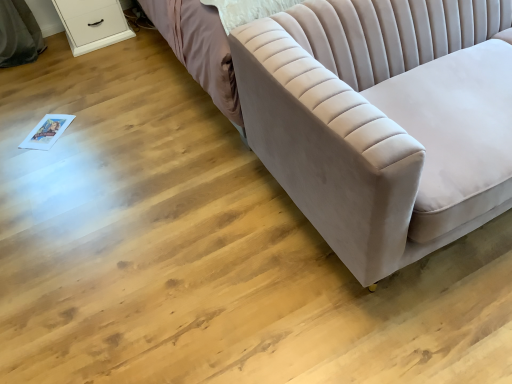
Image resolution: width=512 pixels, height=384 pixels. What do you see at coordinates (92, 23) in the screenshot? I see `white glossy dresser at upper left` at bounding box center [92, 23].

What are the coordinates of `white glossy dresser at upper left` in the screenshot? It's located at (92, 23).

Measure the distance between white glossy dresser at upper left and camera.

white glossy dresser at upper left is 9.16 feet away from camera.

Measure the distance between point [294,183] and camera.

Point [294,183] and camera are 1.51 meters apart.

What do you see at coordinates (383, 120) in the screenshot? This screenshot has height=384, width=512. I see `velvet beige couch at right` at bounding box center [383, 120].

In order to face velvet beige couch at right, should I rotate leftwards or rightwards?

It's best to rotate right around 28.003 degrees.

Measure the distance between velvet beige couch at right and camera.

The depth of velvet beige couch at right is 37.84 inches.

Where is `velvet beige couch at right`? The width and height of the screenshot is (512, 384). velvet beige couch at right is located at coordinates (383, 120).

Where is `white glossy dresser at upper left`? The height and width of the screenshot is (384, 512). white glossy dresser at upper left is located at coordinates (92, 23).

Would you say velvet beige couch at right is to the left or to the right of white glossy dresser at upper left in the picture?

velvet beige couch at right is to the right of white glossy dresser at upper left.

Which object is closer to the camera taking this photo, velvet beige couch at right or white glossy dresser at upper left?

velvet beige couch at right is in front.

Does point (352, 3) come closer to viewer compared to point (87, 5)?

Yes.

From the image's perspective, is velvet beige couch at right above or below white glossy dresser at upper left?

Clearly, from the image's perspective, velvet beige couch at right is below white glossy dresser at upper left.

From a real-world perspective, who is located lower, velvet beige couch at right or white glossy dresser at upper left?

In real-world perspective, white glossy dresser at upper left is lower.

Can you confirm if velvet beige couch at right is wider than white glossy dresser at upper left?

Yes.

Considering the relative sizes of velvet beige couch at right and white glossy dresser at upper left in the image provided, is velvet beige couch at right taller than white glossy dresser at upper left?

Indeed, velvet beige couch at right has a greater height compared to white glossy dresser at upper left.

Looking at this image, between velvet beige couch at right and white glossy dresser at upper left, which one has smaller size?

Smaller between the two is white glossy dresser at upper left.

From the picture: Is white glossy dresser at upper left surrounded by velvet beige couch at right?

No.

Would you say velvet beige couch at right is a long distance from white glossy dresser at upper left?

That's right, there is a large distance between velvet beige couch at right and white glossy dresser at upper left.

Is velvet beige couch at right facing towards white glossy dresser at upper left?

No, velvet beige couch at right is not turned towards white glossy dresser at upper left.

What's the angular difference between velvet beige couch at right and white glossy dresser at upper left's facing directions?

2.04 degrees separate the facing orientations of velvet beige couch at right and white glossy dresser at upper left.

In order to click on dresser above the velvet beige couch at right (from the image's perspective) in this screenshot , I will do `click(92, 23)`.

Consider the image. Which object is positioned more to the right, white glossy dresser at upper left or velvet beige couch at right?

From the viewer's perspective, velvet beige couch at right appears more on the right side.

Which object is more forward, white glossy dresser at upper left or velvet beige couch at right?

velvet beige couch at right is closer to the camera.

Is point (90, 33) less distant than point (319, 166)?

No, it is behind (319, 166).

From the image's perspective, would you say white glossy dresser at upper left is shown under velvet beige couch at right?

Actually, white glossy dresser at upper left appears above velvet beige couch at right in the image.

From a real-world perspective, is white glossy dresser at upper left positioned over velvet beige couch at right based on gravity?

No, from a real-world perspective, white glossy dresser at upper left is not on top of velvet beige couch at right.

Does white glossy dresser at upper left have a lesser width compared to velvet beige couch at right?

Yes, white glossy dresser at upper left is thinner than velvet beige couch at right.

In terms of height, does white glossy dresser at upper left look taller or shorter compared to velvet beige couch at right?

Clearly, white glossy dresser at upper left is shorter compared to velvet beige couch at right.

Considering the sizes of objects white glossy dresser at upper left and velvet beige couch at right in the image provided, who is smaller, white glossy dresser at upper left or velvet beige couch at right?

Smaller between the two is white glossy dresser at upper left.

Is white glossy dresser at upper left located outside velvet beige couch at right?

Yes, white glossy dresser at upper left is located beyond the bounds of velvet beige couch at right.

Is white glossy dresser at upper left not near velvet beige couch at right?

Yes, white glossy dresser at upper left is far from velvet beige couch at right.

Is white glossy dresser at upper left turned away from velvet beige couch at right?

white glossy dresser at upper left is not turned away from velvet beige couch at right.

What's the angular difference between white glossy dresser at upper left and velvet beige couch at right's facing directions?

The angle between the facing direction of white glossy dresser at upper left and the facing direction of velvet beige couch at right is 2.04 degrees.

At what (x,y) coordinates should I click in order to perform the action: click on studio couch in front of the white glossy dresser at upper left. Please return your answer as a coordinate pair (x, y). The image size is (512, 384). Looking at the image, I should click on (383, 120).

You are a GUI agent. You are given a task and a screenshot of the screen. Output one action in this format:
    pyautogui.click(x=<x>, y=<y>)
    Task: Click on the studio couch located in front of the white glossy dresser at upper left
    This screenshot has height=384, width=512.
    Given the screenshot: What is the action you would take?
    pyautogui.click(x=383, y=120)

In the image, there is a velvet beige couch at right. Where is `dresser above it (from the image's perspective)`? The image size is (512, 384). dresser above it (from the image's perspective) is located at coordinates (92, 23).